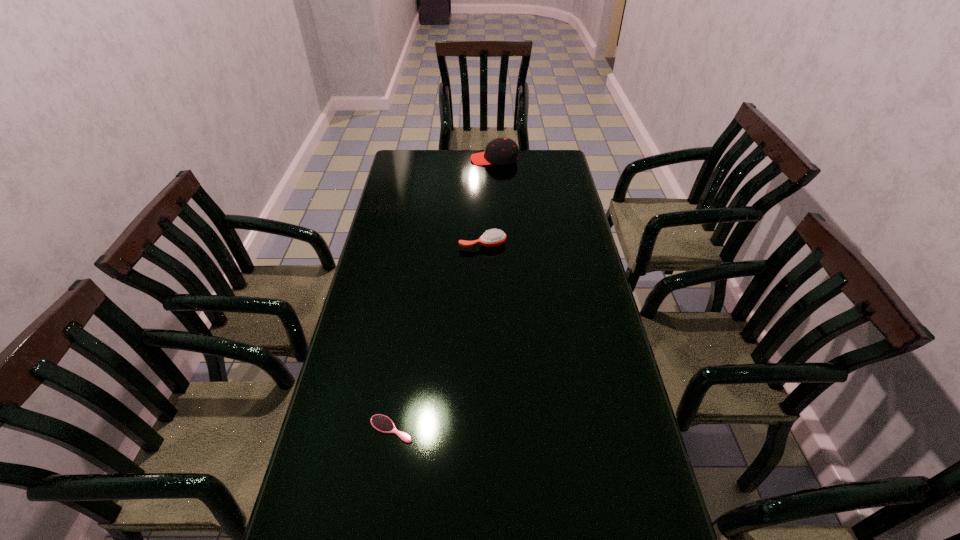
The height and width of the screenshot is (540, 960). I want to click on vacant space that satisfies the following two spatial constraints: 1. on the front-facing side of the farthest object; 2. on the front side of the nearer hairbrush, so click(x=507, y=429).

Image resolution: width=960 pixels, height=540 pixels. I want to click on free location that satisfies the following two spatial constraints: 1. on the front-facing side of the farthest object; 2. on the front side of the second farthest object, so click(x=498, y=244).

Image resolution: width=960 pixels, height=540 pixels. What are the coordinates of `vacant space that satisfies the following two spatial constraints: 1. on the front-facing side of the tallest object; 2. on the front side of the nearest object` in the screenshot? It's located at (507, 429).